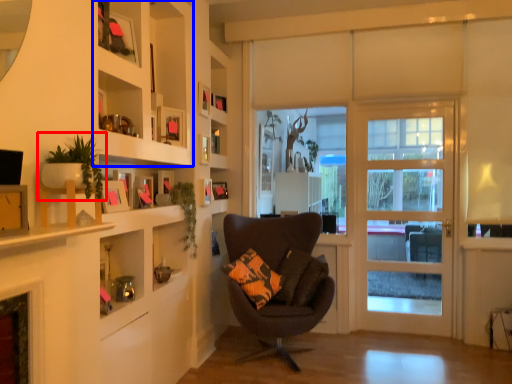
Question: Which of the following is the closest to the observer, houseplant (highlighted by a red box) or cabinet (highlighted by a blue box)?

Choices:
 (A) houseplant
 (B) cabinet

Answer: (A)